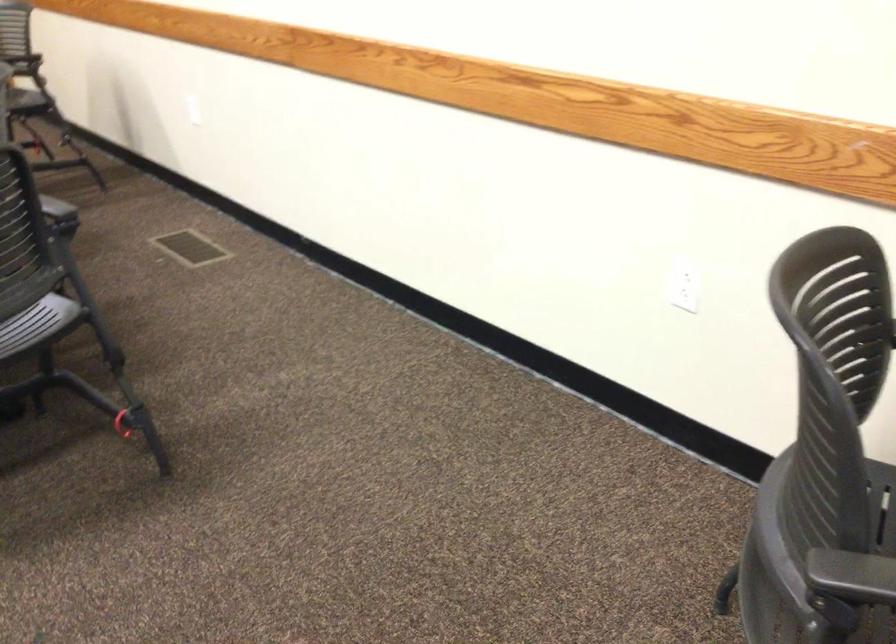
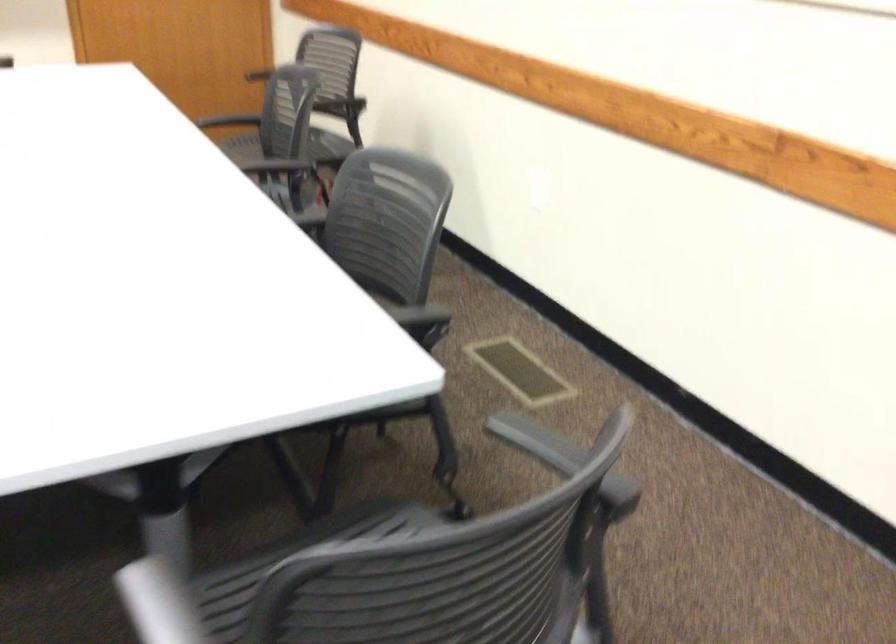
Question: I am providing you with two images of the same scene from different viewpoints. After the viewpoint changes to image2, which objects are now occluded?

Choices:
 (A) grey chair armrest
 (B) yellow bucket handle
 (C) grey plastic part
 (D) black chair armrest

Answer: (D)